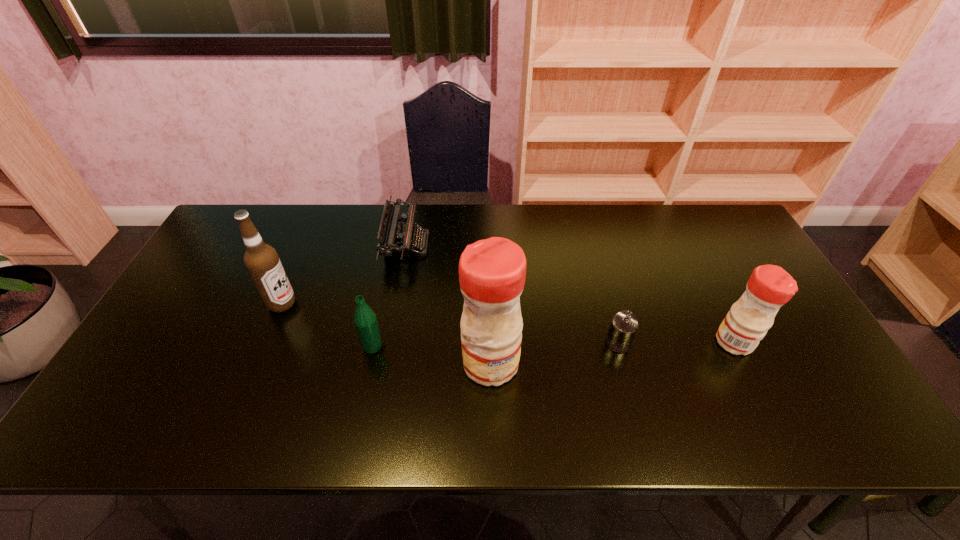
Locate an element on the screen. The height and width of the screenshot is (540, 960). vacant space at the left edge of the desktop is located at coordinates (193, 292).

Where is `vacant space at the right edge of the desktop`? This screenshot has width=960, height=540. vacant space at the right edge of the desktop is located at coordinates (796, 321).

Locate an element on the screen. free space at the far left corner of the desktop is located at coordinates (213, 249).

Identify the location of vacant region at the far right corner. (684, 207).

Identify the location of vacant point located between the shorter condiment and the second object from right to left. The height and width of the screenshot is (540, 960). (676, 343).

Image resolution: width=960 pixels, height=540 pixels. What are the coordinates of `free space between the third tallest object and the second object from right to left` in the screenshot? It's located at (676, 343).

The image size is (960, 540). I want to click on free space between the second object from right to left and the taller condiment, so click(554, 353).

At what (x,y) coordinates should I click in order to perform the action: click on free point between the farthest object and the left condiment. Please return your answer as a coordinate pair (x, y). The image size is (960, 540). Looking at the image, I should click on (448, 304).

Identify the location of unoccupied position between the second object from right to left and the second farthest object. The width and height of the screenshot is (960, 540). (450, 323).

At what (x,y) coordinates should I click in order to perform the action: click on empty space that is in between the fourth tallest object and the farthest object. Please return your answer as a coordinate pair (x, y). This screenshot has height=540, width=960. Looking at the image, I should click on (390, 295).